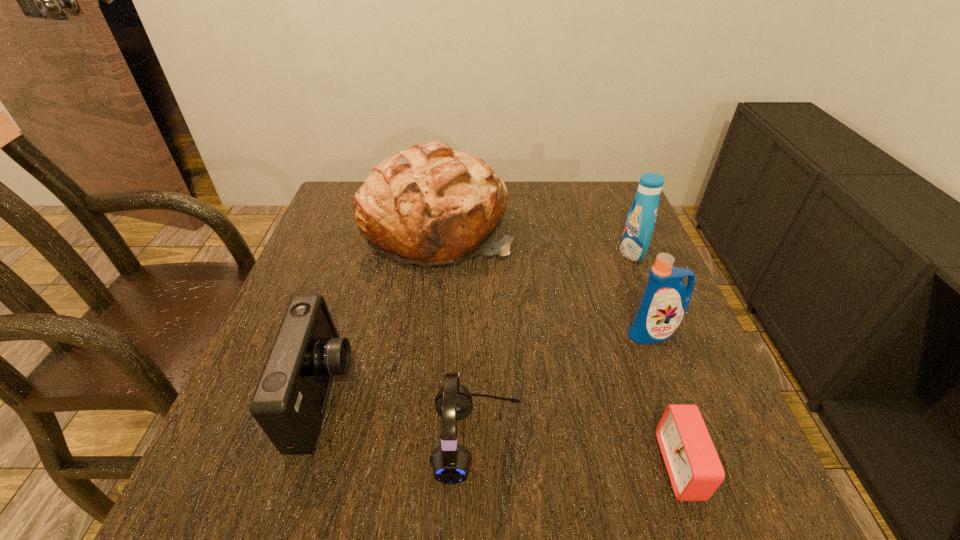
The image size is (960, 540). Identify the location of camera that is at the left edge. (289, 401).

I want to click on alarm clock at the right edge, so click(x=695, y=471).

Identify the location of object present at the far left corner. The width and height of the screenshot is (960, 540). (428, 205).

You are a GUI agent. You are given a task and a screenshot of the screen. Output one action in this format:
    pyautogui.click(x=<x>, y=<y>)
    Task: Click on the object that is positioned at the near right corner
    
    Given the screenshot: What is the action you would take?
    pyautogui.click(x=695, y=471)

You are a GUI agent. You are given a task and a screenshot of the screen. Output one action in this format:
    pyautogui.click(x=<x>, y=<y>)
    Task: Click on the vacant space at the far edge
    
    Given the screenshot: What is the action you would take?
    pyautogui.click(x=530, y=217)

Locate an element on the screen. The height and width of the screenshot is (540, 960). free space at the near edge of the desktop is located at coordinates (538, 516).

The image size is (960, 540). I want to click on vacant region at the left edge, so click(x=299, y=282).

At what (x,y) coordinates should I click in order to perform the action: click on vacant space at the right edge of the desktop. Please return your answer as a coordinate pair (x, y). Looking at the image, I should click on (610, 321).

The width and height of the screenshot is (960, 540). Find the location of `free space at the near left corner`. free space at the near left corner is located at coordinates (256, 465).

What are the coordinates of `blank area at the far right corner` in the screenshot? It's located at (622, 203).